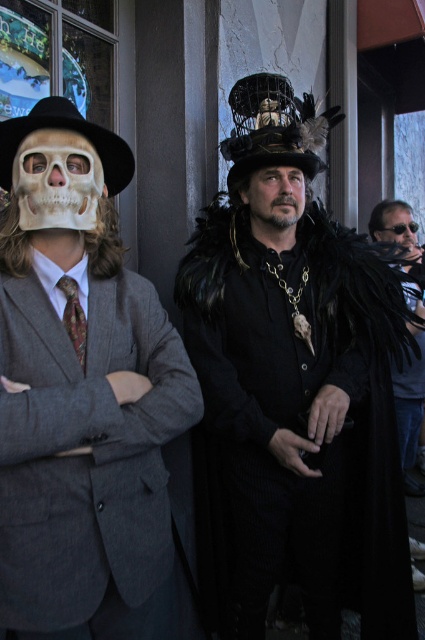
Question: Is white matte skull mask at left in front of black felt hat at left?

Choices:
 (A) yes
 (B) no

Answer: (B)

Question: Is bearded man at center closer to the viewer compared to patterned silk tie at left?

Choices:
 (A) yes
 (B) no

Answer: (B)

Question: Based on their relative distances, which object is farther from the black velvet cape at right?

Choices:
 (A) patterned silk tie at left
 (B) matte black sunglasses at upper right

Answer: (A)

Question: Estimate the real-world distances between objects in this image. Which object is farther from the white matte skull mask at left?

Choices:
 (A) bearded man at center
 (B) patterned silk tie at left

Answer: (A)

Question: Is shiny black feathered hat at center to the right of black felt hat at left from the viewer's perspective?

Choices:
 (A) no
 (B) yes

Answer: (B)

Question: Which point appears closest to the camera in this image?

Choices:
 (A) (99, 317)
 (B) (255, 173)
 (C) (407, 268)
 (D) (263, 353)

Answer: (A)